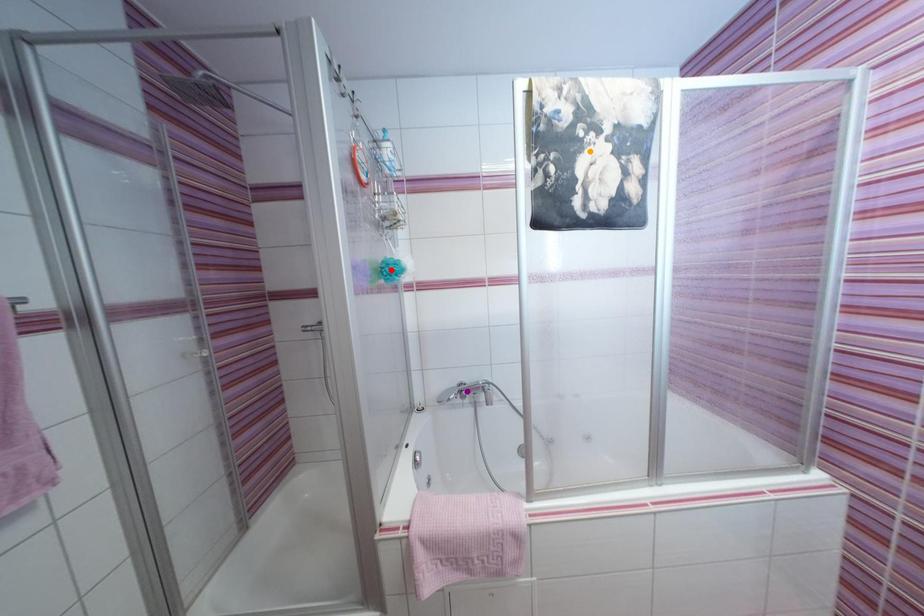
Order these from farthest to nearest:
- orange point
- purple point
- red point

purple point, red point, orange point